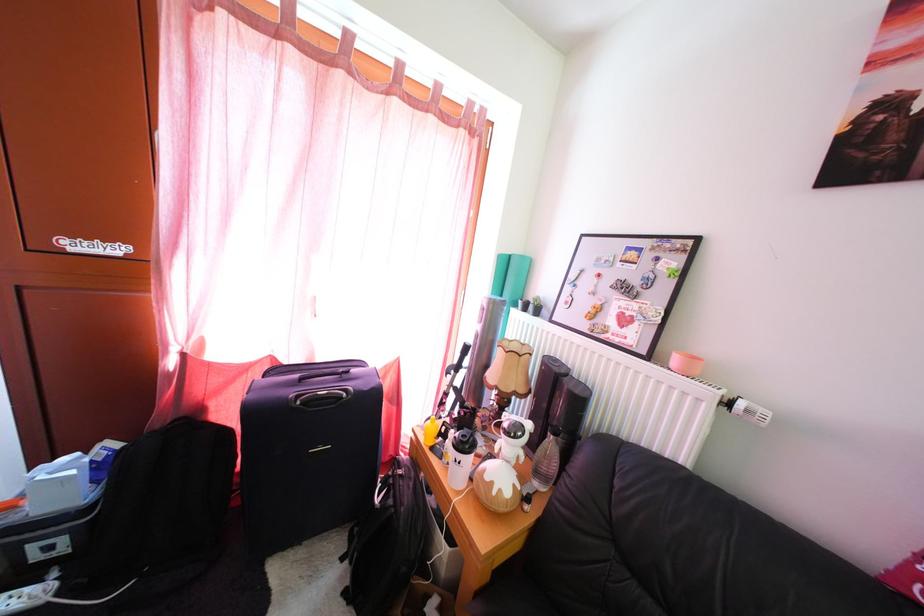
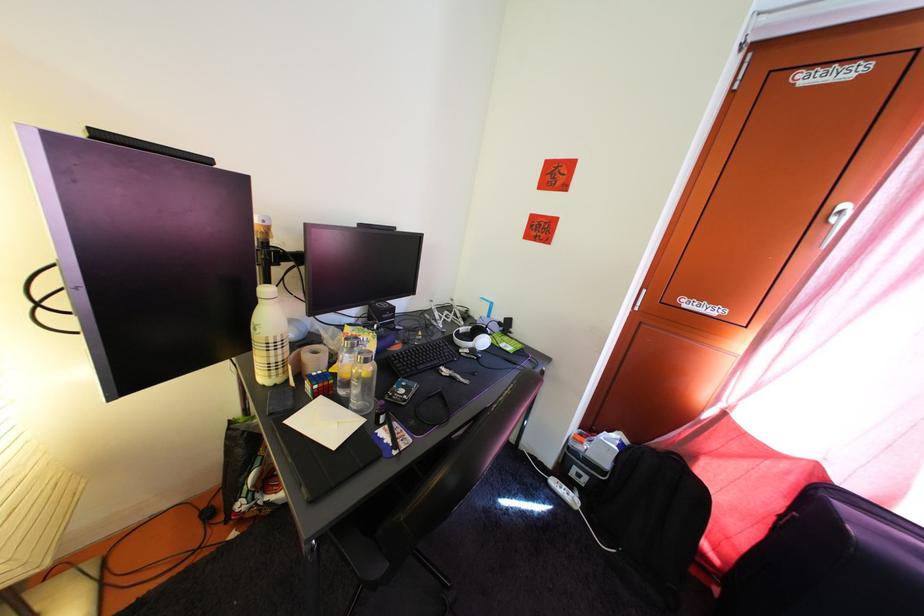
Question: The images are taken continuously from a first-person perspective. In which direction is your viewpoint rotating?

Choices:
 (A) Left
 (B) Right
 (C) Up
 (D) Down

Answer: (A)